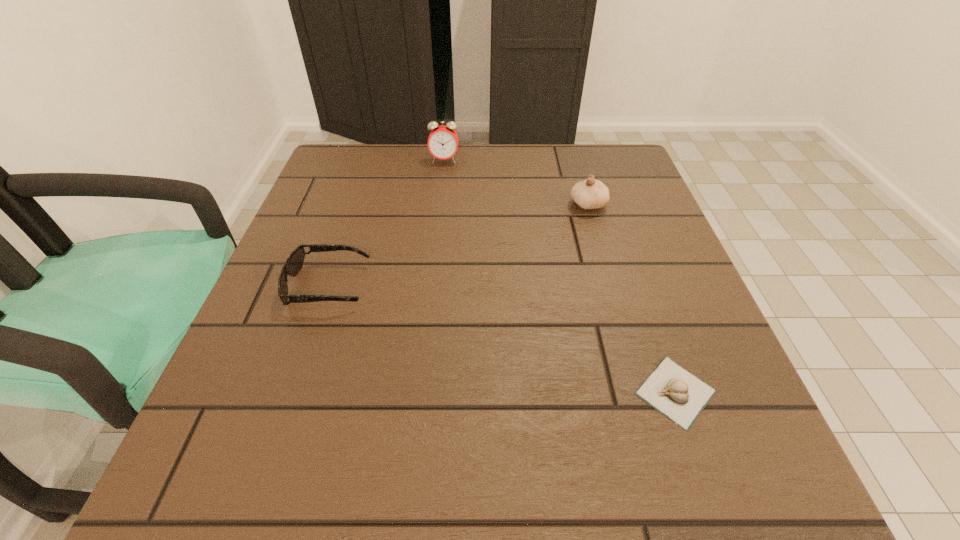
Image resolution: width=960 pixels, height=540 pixels. In order to click on vacant space at the near left corner in this screenshot , I will do `click(266, 506)`.

At what (x,y) coordinates should I click in order to perform the action: click on free point between the shortest object and the third farthest object. Please return your answer as a coordinate pair (x, y). The width and height of the screenshot is (960, 540). Looking at the image, I should click on (502, 339).

Where is `free spot between the third object from right to left and the shorter garlic`? free spot between the third object from right to left and the shorter garlic is located at coordinates (560, 276).

Find the location of a particular element. empty space between the leftmost object and the nearest object is located at coordinates (502, 339).

At what (x,y) coordinates should I click in order to perform the action: click on free space that is in between the tallest object and the third shortest object. Please return your answer as a coordinate pair (x, y). Looking at the image, I should click on (516, 183).

Locate an element on the screen. The height and width of the screenshot is (540, 960). vacant area that lies between the third shortest object and the tallest object is located at coordinates (516, 183).

Where is `empty space between the third tallest object and the nearest object`? empty space between the third tallest object and the nearest object is located at coordinates (502, 339).

Locate an element on the screen. blank region between the third tallest object and the third nearest object is located at coordinates (458, 245).

Locate an element on the screen. The height and width of the screenshot is (540, 960). vacant space that is in between the second shortest object and the farther garlic is located at coordinates (458, 245).

What are the coordinates of `vacant space in between the nearer garlic and the farthest object` in the screenshot? It's located at (560, 276).